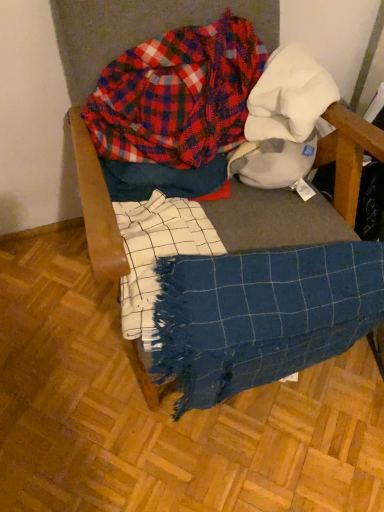
Question: From a real-world perspective, is plaid flannel shirt at upper center positioned over blue woven blanket at lower right based on gravity?

Choices:
 (A) yes
 (B) no

Answer: (A)

Question: Is plaid flannel shirt at upper center touching blue woven blanket at lower right?

Choices:
 (A) no
 (B) yes

Answer: (A)

Question: From a real-world perspective, is plaid flannel shirt at upper center positioned under blue woven blanket at lower right based on gravity?

Choices:
 (A) no
 (B) yes

Answer: (A)

Question: Does plaid flannel shirt at upper center appear on the right side of blue woven blanket at lower right?

Choices:
 (A) yes
 (B) no

Answer: (B)

Question: Is blue woven blanket at lower right at the back of plaid flannel shirt at upper center?

Choices:
 (A) yes
 (B) no

Answer: (B)

Question: Does plaid flannel shirt at upper center have a lesser height compared to blue woven blanket at lower right?

Choices:
 (A) yes
 (B) no

Answer: (A)

Question: From the image's perspective, is blue woven blanket at lower right above blue woven blanket at center?

Choices:
 (A) no
 (B) yes

Answer: (A)

Question: Is blue woven blanket at lower right wider than blue woven blanket at center?

Choices:
 (A) no
 (B) yes

Answer: (A)

Question: Does blue woven blanket at lower right turn towards blue woven blanket at center?

Choices:
 (A) yes
 (B) no

Answer: (B)

Question: Can you confirm if blue woven blanket at lower right is taller than blue woven blanket at center?

Choices:
 (A) no
 (B) yes

Answer: (A)

Question: Does blue woven blanket at lower right appear on the right side of blue woven blanket at center?

Choices:
 (A) no
 (B) yes

Answer: (B)

Question: Is blue woven blanket at lower right oriented away from blue woven blanket at center?

Choices:
 (A) no
 (B) yes

Answer: (B)

Question: Is blue woven blanket at lower right oriented away from plaid flannel shirt at upper center?

Choices:
 (A) no
 (B) yes

Answer: (B)